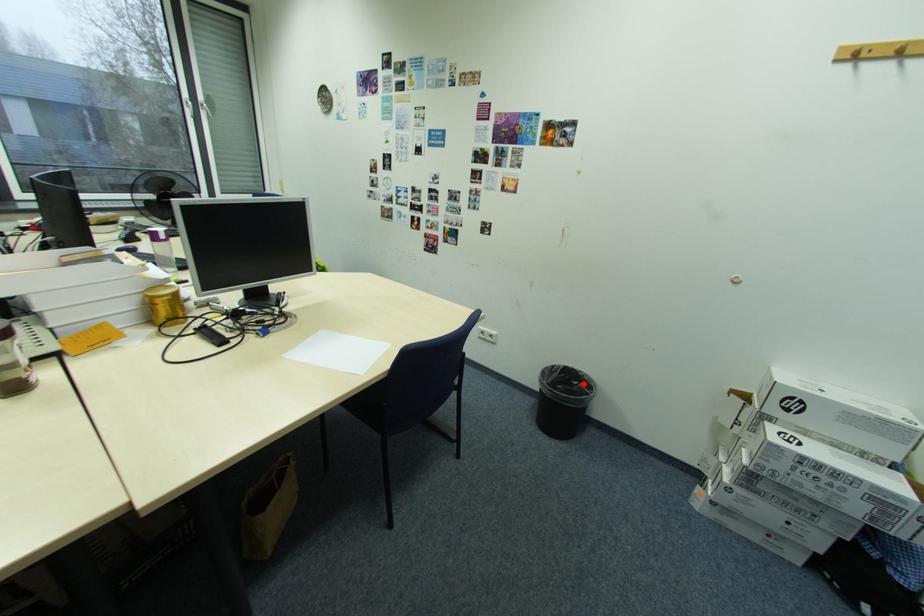
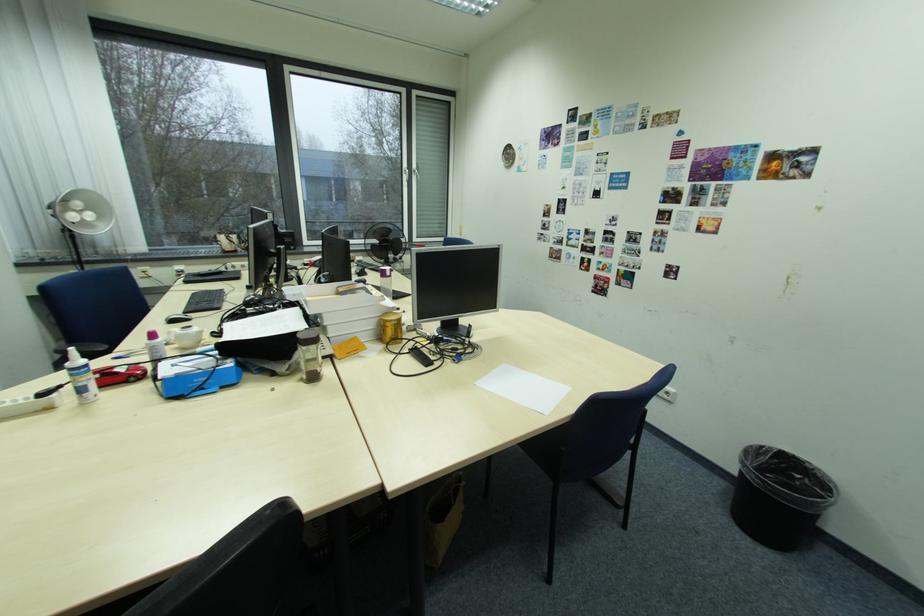
Where in the second image is the point corresponding to the highlighted location from the first image?

(807, 477)